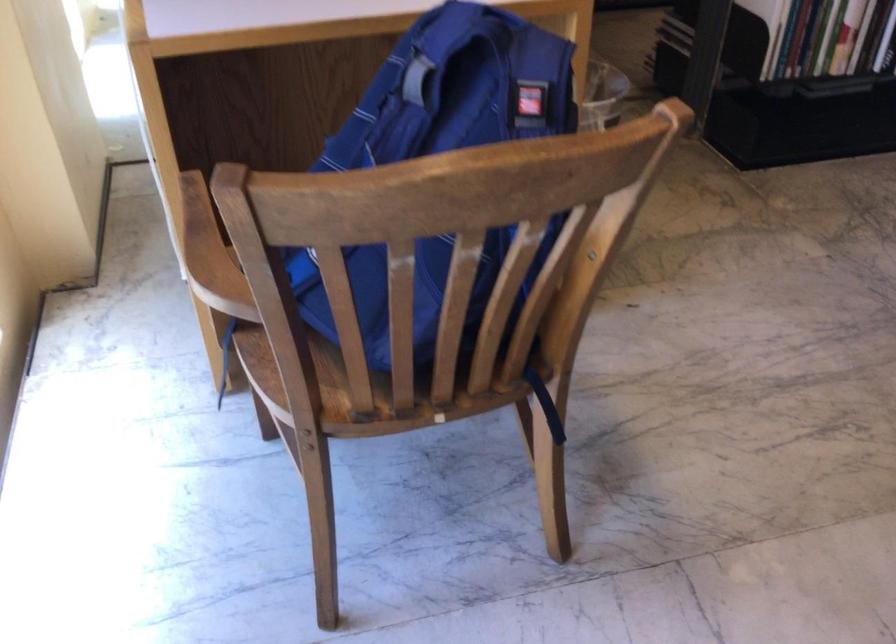
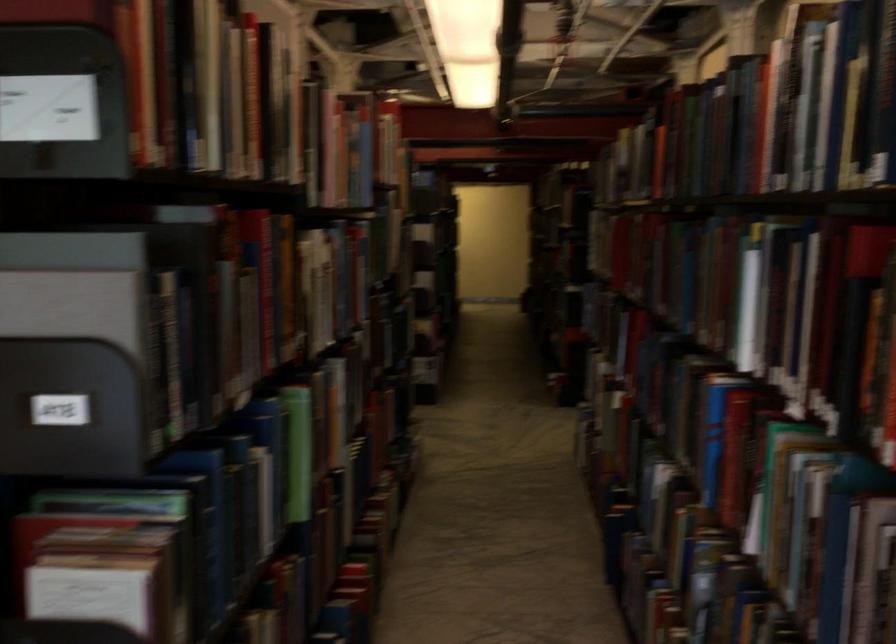
Question: The camera is either moving clockwise (left) or counter-clockwise (right) around the object. The first image is from the beginning of the video and the second image is from the end. Is the camera moving left or right when shooting the video?

Choices:
 (A) Left
 (B) Right

Answer: (A)